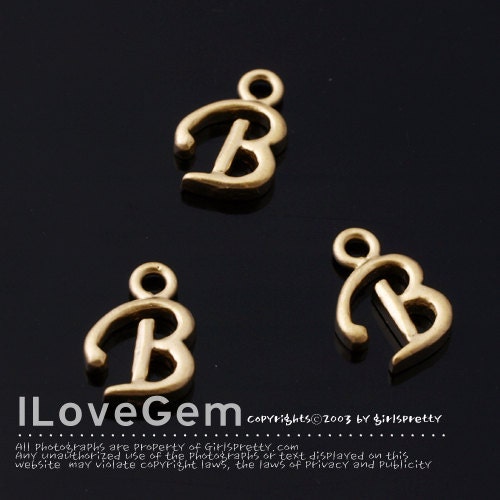
Where is `"b" pendant in the back`? The height and width of the screenshot is (500, 500). "b" pendant in the back is located at coordinates 233,144.